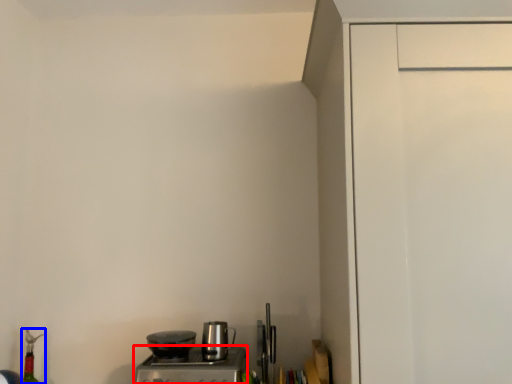
Question: Among these objects, which one is nearest to the camera, home appliance (highlighted by a red box) or bottle (highlighted by a blue box)?

Choices:
 (A) home appliance
 (B) bottle

Answer: (A)